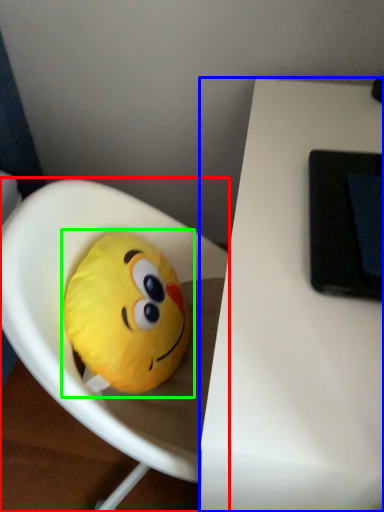
Question: Which object is the farthest from toy (highlighted by a red box)? Choose among these: table (highlighted by a blue box) or toy (highlighted by a green box).

Choices:
 (A) table
 (B) toy

Answer: (A)